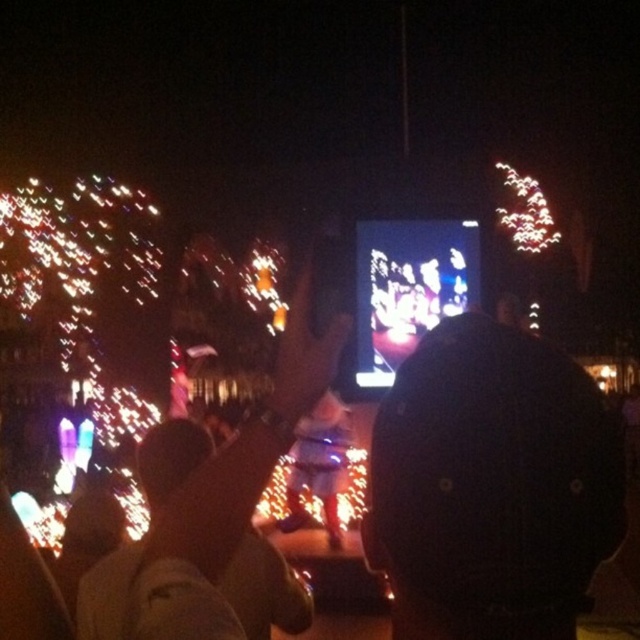
Question: Is shiny gold jacket at center to the left of shiny plastic phone at center from the viewer's perspective?

Choices:
 (A) no
 (B) yes

Answer: (B)

Question: Is shiny gold jacket at center wider than shiny plastic phone at center?

Choices:
 (A) no
 (B) yes

Answer: (A)

Question: Among these points, which one is nearest to the camera?

Choices:
 (A) (420, 296)
 (B) (166, 500)
 (C) (403, 632)

Answer: (C)

Question: Is shiny gold jacket at center to the left of shiny plastic phone at center from the viewer's perspective?

Choices:
 (A) no
 (B) yes

Answer: (B)

Question: Among these points, which one is farthest from the camera?

Choices:
 (A) (460, 337)
 (B) (360, 241)
 (C) (83, 630)

Answer: (B)

Question: Which is nearer to the shiny plastic phone at center?

Choices:
 (A) shiny gold jacket at center
 (B) black matte jacket at center

Answer: (A)